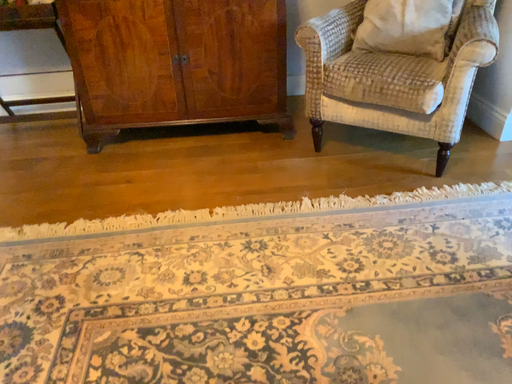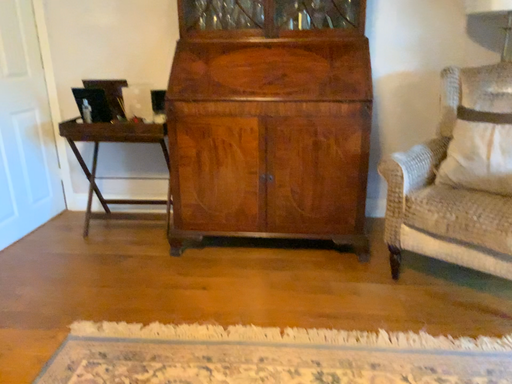
Question: Which way did the camera rotate in the video?

Choices:
 (A) rotated left
 (B) rotated right

Answer: (A)